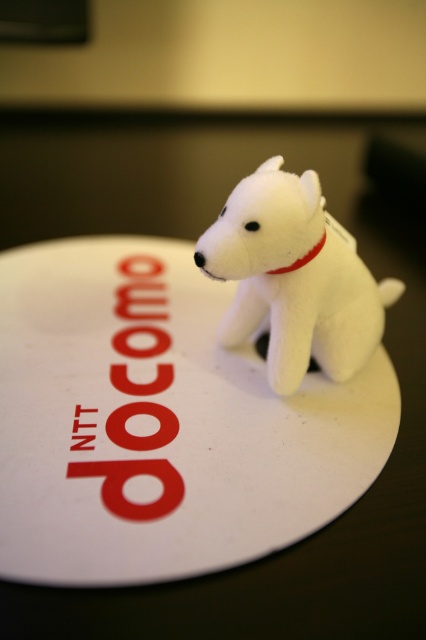
The image size is (426, 640). Describe the element at coordinates (293, 276) in the screenshot. I see `white plush dog at center` at that location.

Is point (313, 234) less distant than point (299, 259)?

Yes, point (313, 234) is in front of point (299, 259).

Between point (287, 250) and point (313, 246), which one is positioned in front?

Positioned in front is point (287, 250).

Identify the location of white plush dog at center. Image resolution: width=426 pixels, height=640 pixels. (293, 276).

Can you confirm if white paper plate at center is wider than white fabric neckband at center?

Correct, the width of white paper plate at center exceeds that of white fabric neckband at center.

Is white paper plate at center taller than white fabric neckband at center?

Yes, white paper plate at center is taller than white fabric neckband at center.

Measure the distance between white paper plate at center and camera.

A distance of 35.96 inches exists between white paper plate at center and camera.

Where is `white paper plate at center`? The image size is (426, 640). white paper plate at center is located at coordinates (160, 422).

Is white paper plate at center bigger than white plush dog at center?

Yes.

Who is higher up, white paper plate at center or white plush dog at center?

white plush dog at center is higher up.

Does point (86, 403) lie behind point (377, 298)?

That is False.

This screenshot has height=640, width=426. I want to click on white paper plate at center, so click(x=160, y=422).